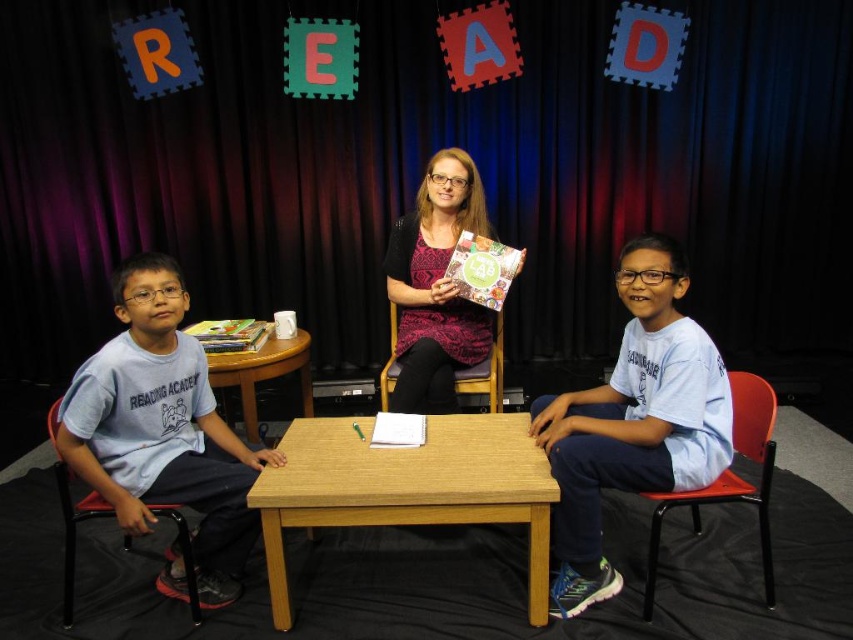
You are setting up a stage for an event and need to decide if the black curtain at upper center will cover the light brown wood table at center completely. Based on their sizes, can the curtain cover the table?

The black curtain at upper center might be wider than light brown wood table at center, so it could potentially cover the table completely depending on its exact dimensions.

You are an event planner setting up for a presentation. You need to place a large projector screen behind the light brown wood table at center so that it is visible to the audience. Considering the black curtain at upper center, will the screen be visible behind the table?

The black curtain at upper center is further to the viewer than the light brown wood table at center, so placing the projector screen behind the table would position it closer to the audience than the curtain. This means the screen might be obstructed by the table itself or not positioned correctly for visibility. To ensure visibility, the screen should be placed in front of the curtain or adjusted so it is between the table and the curtain.